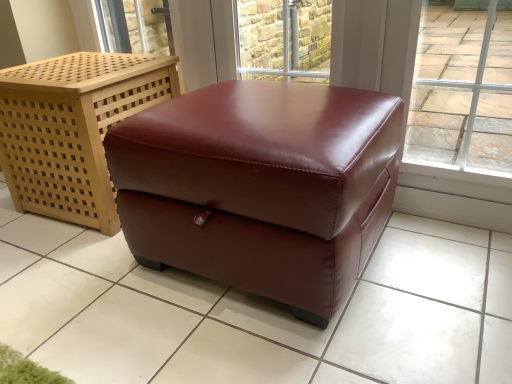
I want to click on free space in front of glossy leather ottoman at center, so click(276, 343).